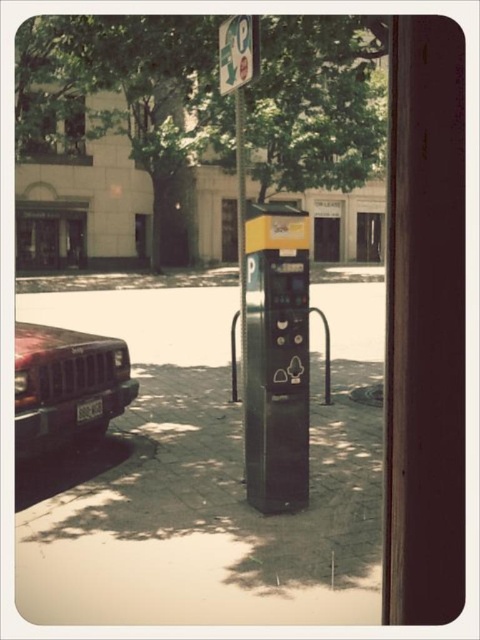
Consider the image. Can you confirm if black plastic parking meter at center is positioned to the left of metallic parking sign at upper center?

In fact, black plastic parking meter at center is to the right of metallic parking sign at upper center.

Consider the image. Is black plastic parking meter at center bigger than metallic parking sign at upper center?

Indeed, black plastic parking meter at center has a larger size compared to metallic parking sign at upper center.

This screenshot has height=640, width=480. Describe the element at coordinates (276, 356) in the screenshot. I see `black plastic parking meter at center` at that location.

At what (x,y) coordinates should I click in order to perform the action: click on black plastic parking meter at center. Please return your answer as a coordinate pair (x, y). Image resolution: width=480 pixels, height=640 pixels. Looking at the image, I should click on (276, 356).

Can you confirm if concrete pavement at center is taller than black plastic parking meter at center?

Incorrect, concrete pavement at center's height is not larger of black plastic parking meter at center's.

Who is lower down, concrete pavement at center or black plastic parking meter at center?

concrete pavement at center is lower down.

Does point (169, 368) lie behind point (250, 221)?

That is True.

This screenshot has height=640, width=480. In order to click on concrete pavement at center in this screenshot , I will do `click(210, 518)`.

Can you confirm if matte red car at left is wider than white plastic license plate at lower left?

Yes.

Find the location of a particular element. matte red car at left is located at coordinates (66, 385).

This screenshot has width=480, height=640. Find the location of `matte red car at left`. matte red car at left is located at coordinates (66, 385).

Where is `matte red car at left`? matte red car at left is located at coordinates (66, 385).